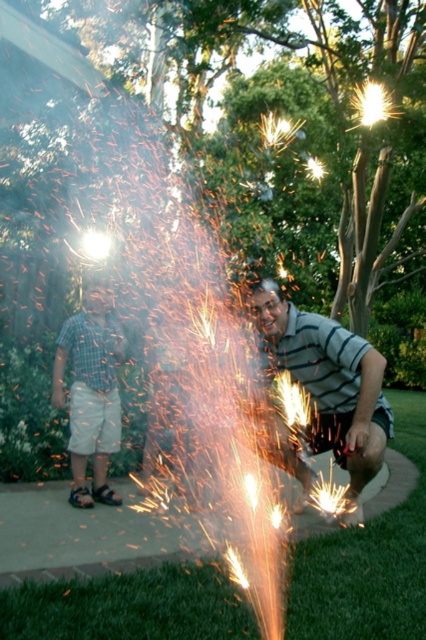
Is matte striped shirt at right in front of checkered fabric shirt at left?

Yes, it is.

Is matte striped shirt at right below checkered fabric shirt at left?

Incorrect, matte striped shirt at right is not positioned below checkered fabric shirt at left.

Identify the location of matte striped shirt at right. (330, 381).